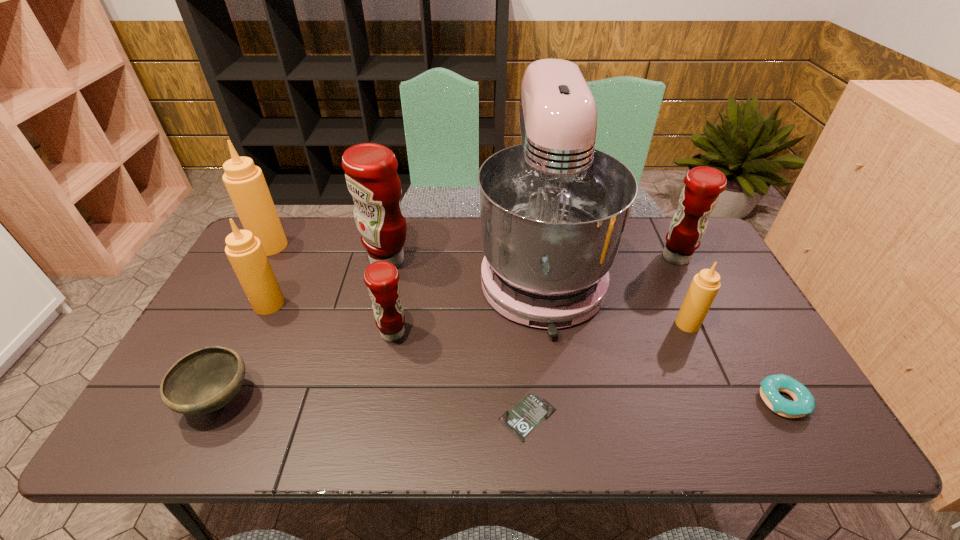
Locate an element on the screen. The image size is (960, 540). unoccupied area between the second smallest tan condiment and the rightmost tan condiment is located at coordinates (478, 314).

You are a GUI agent. You are given a task and a screenshot of the screen. Output one action in this format:
    pyautogui.click(x=<x>, y=<y>)
    Task: Click on the vacant region between the bowl and the identity card
    The image size is (960, 540).
    Given the screenshot: What is the action you would take?
    pyautogui.click(x=373, y=408)

What are the coordinates of `free spot between the shortest object and the second biggest tan condiment` in the screenshot? It's located at (398, 361).

Where is `free spot between the farthest tan condiment and the rightmost red condiment`? free spot between the farthest tan condiment and the rightmost red condiment is located at coordinates (473, 252).

Locate an element on the screen. free spot between the second biggest tan condiment and the identity card is located at coordinates (398, 361).

Locate which object ranks eighth in proximity to the nearest red condiment. Please provide its 2D coordinates. Your answer should be formatted as a tuple, i.e. [(x, y)], where the tuple contains the x and y coordinates of a point satisfying the conditions above.

[(703, 185)]

You are a GUI agent. You are given a task and a screenshot of the screen. Output one action in this format:
    pyautogui.click(x=<x>, y=<y>)
    Task: Click on the object that is the sixth closest one to the identity card
    The height and width of the screenshot is (540, 960).
    Given the screenshot: What is the action you would take?
    pyautogui.click(x=205, y=380)

Where is `condiment that is the fifth closest to the pink mixer`? The height and width of the screenshot is (540, 960). condiment that is the fifth closest to the pink mixer is located at coordinates (245, 252).

This screenshot has height=540, width=960. What are the coordinates of `the fourth closest condiment to the second smallest red condiment` in the screenshot? It's located at (245, 252).

The height and width of the screenshot is (540, 960). Find the location of `tan condiment object that ranks as the third closest to the bowl`. tan condiment object that ranks as the third closest to the bowl is located at coordinates (705, 285).